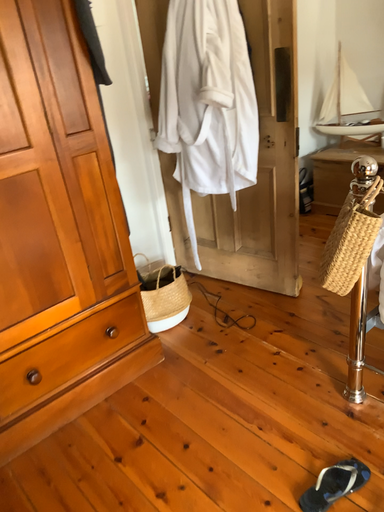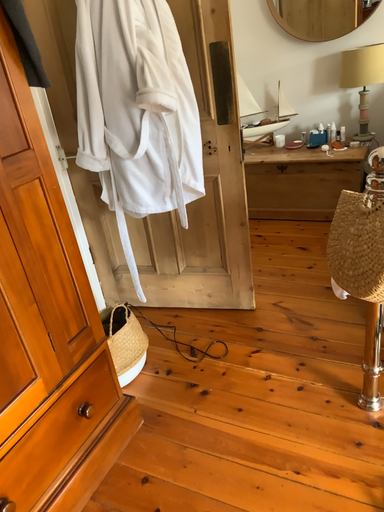
Question: Which way did the camera rotate in the video?

Choices:
 (A) rotated left
 (B) rotated right

Answer: (B)